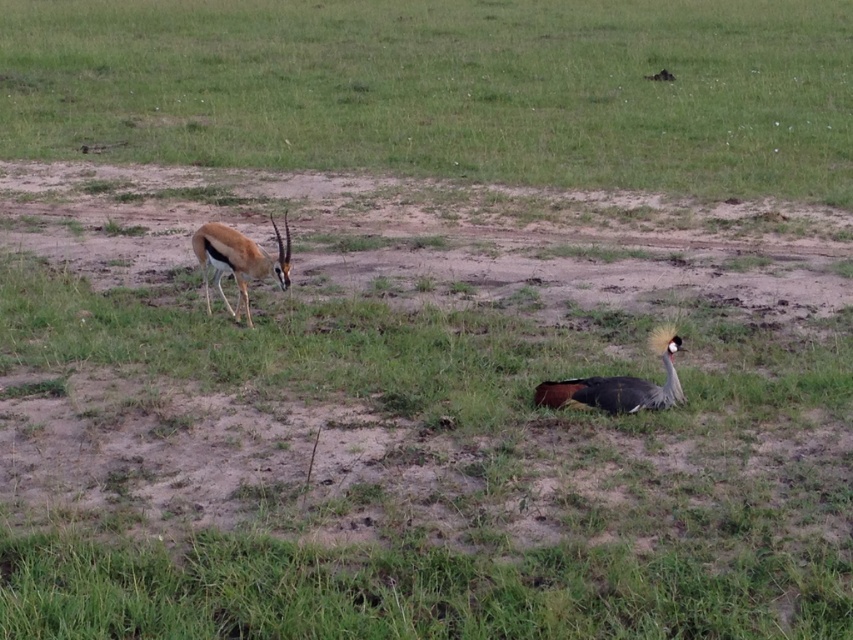
You are standing in the savanna and see the green grass at center and the gray feathered bird at lower right. Which object is closer to your left side?

The green grass at center is closer to your left side because it is positioned to the left of the gray feathered bird at lower right.

You are standing at the origin point of the coordinate system. You want to walk to the green grass at center. Which direction should you go?

The green grass at center is located at coordinate point 0.139 on the x axis and 0.522 on the y axis. Since you are at the origin point, you should move towards the positive x and positive y direction to reach the green grass at center.